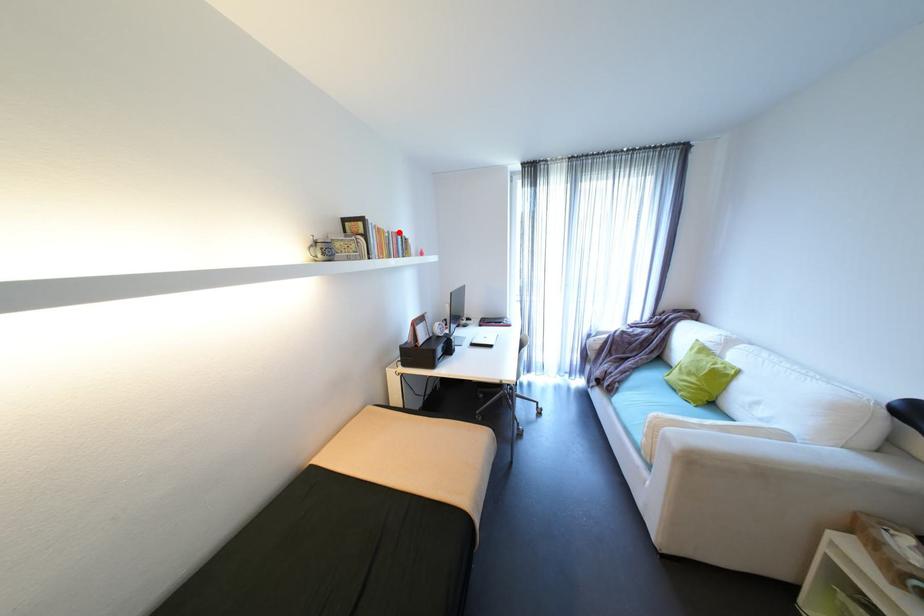
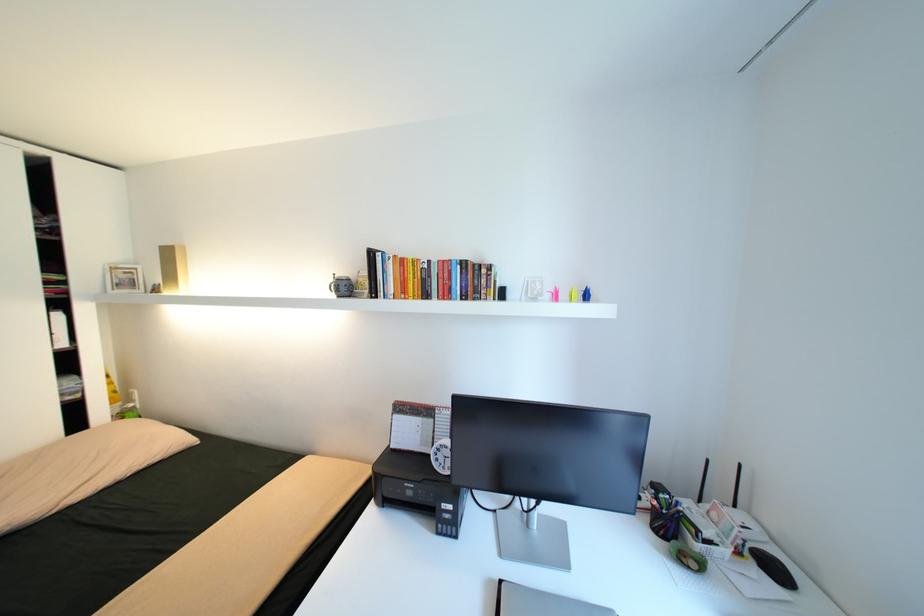
In the second image, find the point that corresponds to the highlighted location in the first image.

(445, 262)